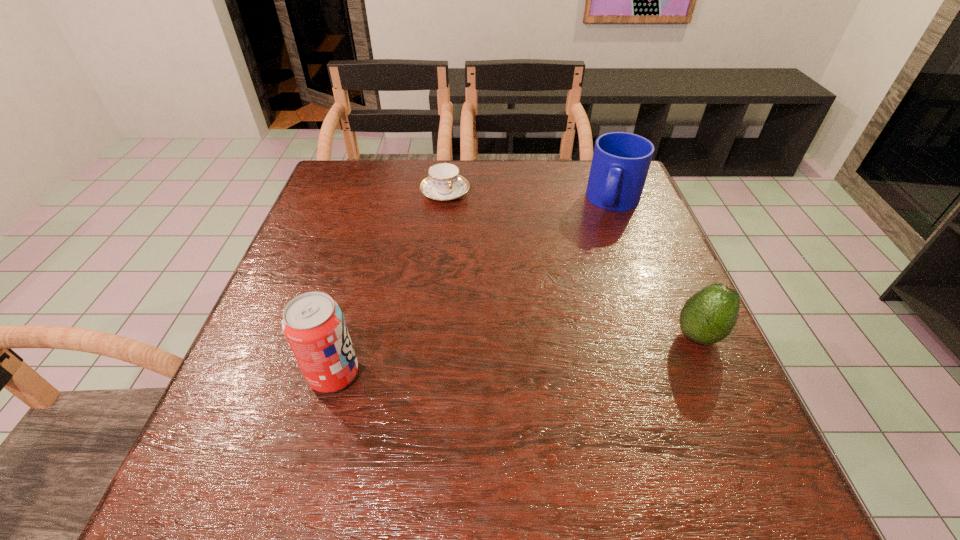
You are a GUI agent. You are given a task and a screenshot of the screen. Output one action in this format:
    pyautogui.click(x=<x>, y=<y>)
    Task: Click on the object situated at the far right corner
    This screenshot has width=960, height=540.
    Given the screenshot: What is the action you would take?
    pyautogui.click(x=620, y=164)

In the image, there is a desktop. Identify the location of free space at the far edge. (516, 165).

Where is `vacant space at the near edge of the desktop`? This screenshot has width=960, height=540. vacant space at the near edge of the desktop is located at coordinates (474, 415).

Where is `vacant space at the left edge of the desktop`? vacant space at the left edge of the desktop is located at coordinates (304, 260).

Image resolution: width=960 pixels, height=540 pixels. In the image, there is a desktop. Identify the location of vacant space at the right edge. (603, 242).

In the image, there is a desktop. In order to click on free region at the far left corner in this screenshot , I will do `click(345, 198)`.

In the image, there is a desktop. At what (x,y) coordinates should I click in order to perform the action: click on free space at the near right corner. Please return your answer as a coordinate pair (x, y). Looking at the image, I should click on (693, 407).

Locate an element on the screen. free space between the leftmost object and the avocado is located at coordinates (516, 355).

You are a GUI agent. You are given a task and a screenshot of the screen. Output one action in this format:
    pyautogui.click(x=<x>, y=<y>)
    Task: Click on the vacant space in between the avocado and the leftmost object
    The width and height of the screenshot is (960, 540).
    Given the screenshot: What is the action you would take?
    pyautogui.click(x=516, y=355)

I want to click on vacant space that's between the shortest object and the soda can, so click(390, 284).